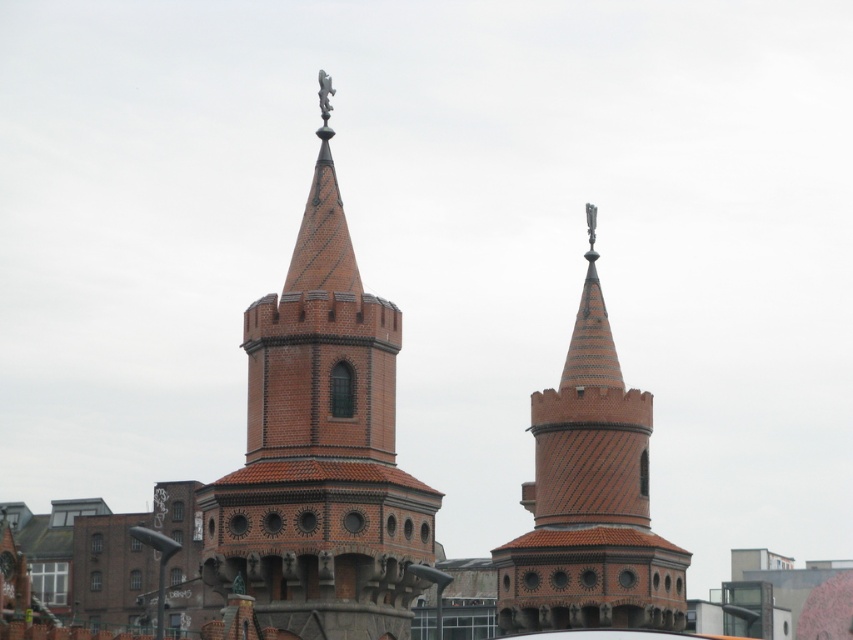
You are standing in front of the two brown brick towers at center. You want to place a small decorative flag exactly at point (320,448). Which tower should you place it on?

Point (320,448) corresponds to the brown brick tower at center, so you should place the flag on the brown brick tower at center.